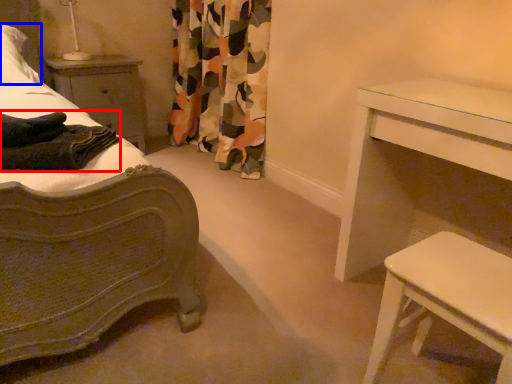
Question: Which point is further to the camera, blanket (highlighted by a red box) or pillow (highlighted by a blue box)?

Choices:
 (A) blanket
 (B) pillow

Answer: (B)